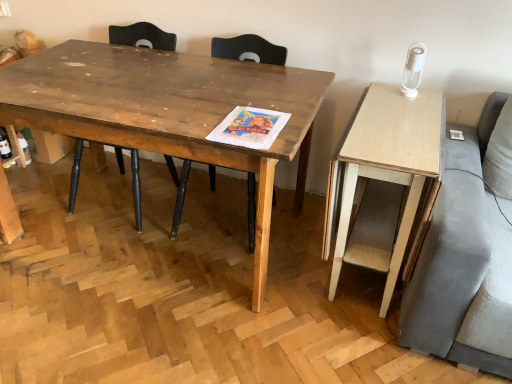
Question: Does wooden table at center have a lesser height compared to wooden chair at center, which appears as the second chair when viewed from the right?

Choices:
 (A) yes
 (B) no

Answer: (A)

Question: Is wooden table at center not near wooden chair at center, marked as the 1th chair in a left-to-right arrangement?

Choices:
 (A) no
 (B) yes

Answer: (A)

Question: Is wooden table at center at the left side of wooden chair at center, which appears as the second chair when viewed from the right?

Choices:
 (A) no
 (B) yes

Answer: (A)

Question: Would you say wooden table at center contains wooden chair at center, marked as the 1th chair in a left-to-right arrangement?

Choices:
 (A) yes
 (B) no

Answer: (A)

Question: Is wooden table at center aimed at wooden chair at center, which appears as the second chair when viewed from the right?

Choices:
 (A) yes
 (B) no

Answer: (A)

Question: Is wooden chair at center, marked as the 1th chair in a left-to-right arrangement, to the left or to the right of light wood desk at right in the image?

Choices:
 (A) left
 (B) right

Answer: (A)

Question: In terms of width, does wooden chair at center, marked as the 1th chair in a left-to-right arrangement, look wider or thinner when compared to light wood desk at right?

Choices:
 (A) thin
 (B) wide

Answer: (A)

Question: Would you say wooden chair at center, marked as the 1th chair in a left-to-right arrangement, is inside or outside light wood desk at right?

Choices:
 (A) inside
 (B) outside

Answer: (B)

Question: Relative to light wood desk at right, is wooden chair at center, marked as the 1th chair in a left-to-right arrangement, in front or behind?

Choices:
 (A) front
 (B) behind

Answer: (B)

Question: Is light wood desk at right bigger or smaller than wooden table at center?

Choices:
 (A) big
 (B) small

Answer: (B)

Question: Considering the positions of light wood desk at right and wooden table at center in the image, is light wood desk at right wider or thinner than wooden table at center?

Choices:
 (A) thin
 (B) wide

Answer: (A)

Question: Would you say light wood desk at right is inside or outside wooden table at center?

Choices:
 (A) outside
 (B) inside

Answer: (A)

Question: Does point (346, 135) appear closer or farther from the camera than point (82, 117)?

Choices:
 (A) closer
 (B) farther

Answer: (B)

Question: Considering their positions, is wooden chair at center, arranged as the 2th chair when viewed from the left, located in front of or behind wooden chair at center, which appears as the second chair when viewed from the right?

Choices:
 (A) front
 (B) behind

Answer: (A)

Question: Which is correct: wooden chair at center, arranged as the 2th chair when viewed from the left, is inside wooden chair at center, marked as the 1th chair in a left-to-right arrangement, or outside of it?

Choices:
 (A) inside
 (B) outside

Answer: (B)